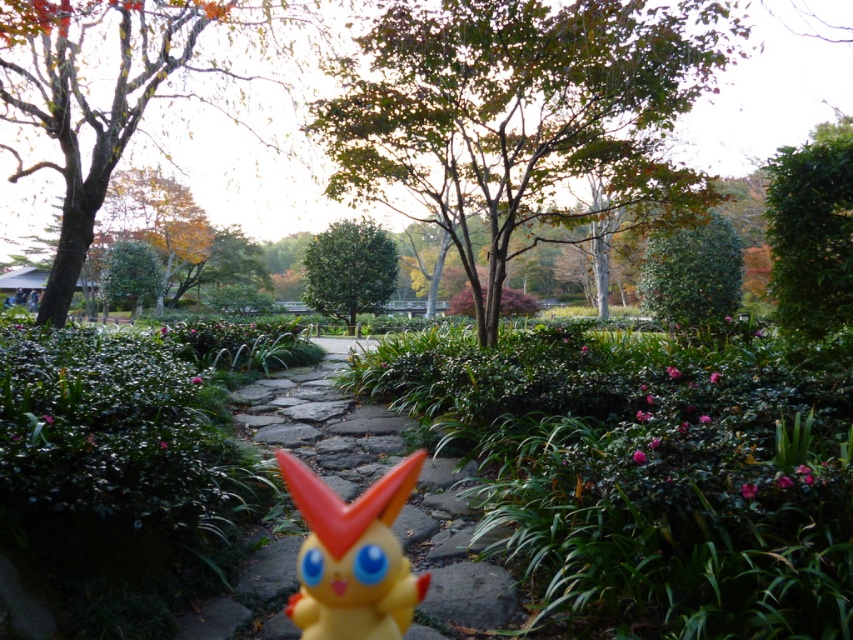
You are a hiker who wants to take a photo of the smooth stone path at center and the green matte tree at center. Which object should you focus on to ensure both are in the frame without moving the camera?

The smooth stone path at center is smaller than the green matte tree at center, so you should focus on the green matte tree at center to ensure both are in the frame without moving the camera.